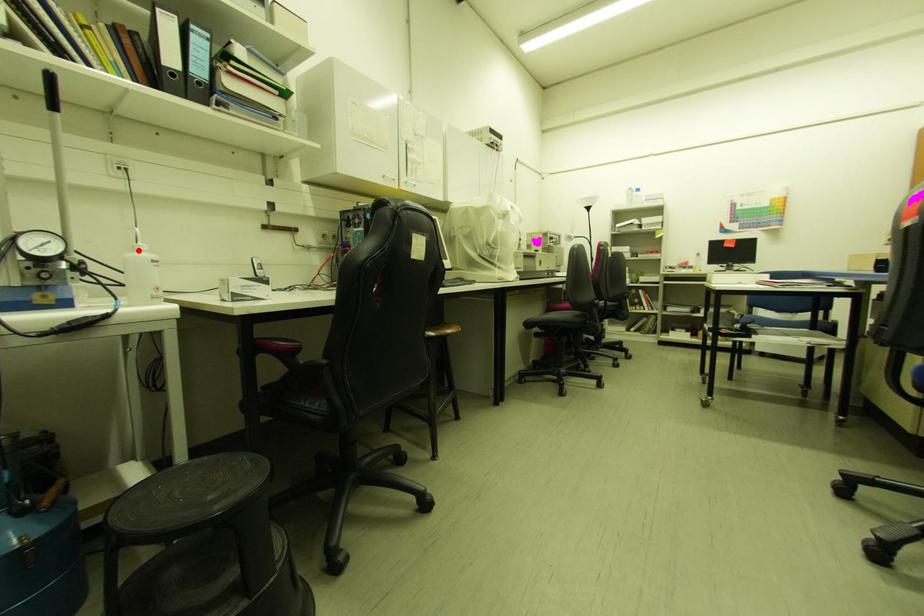
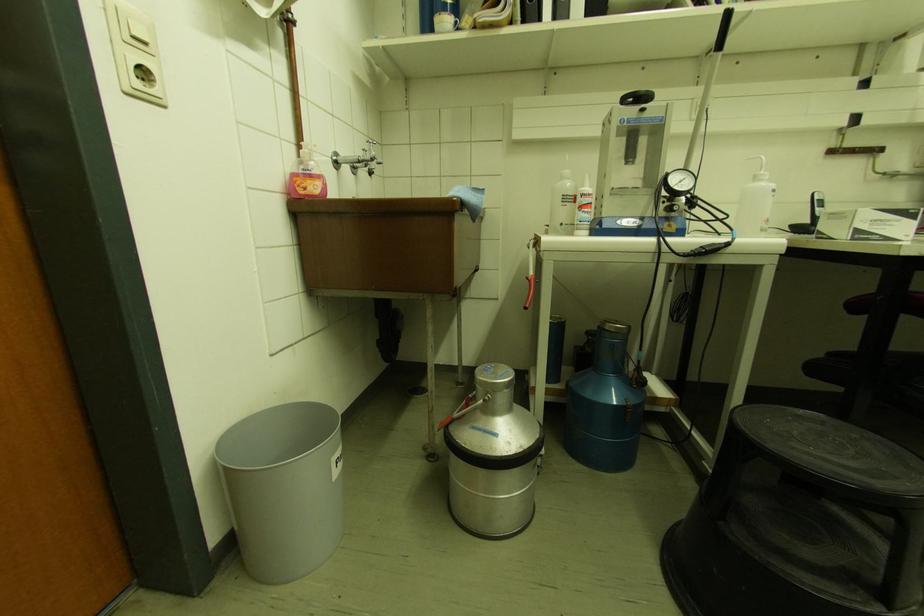
Where in the second image is the point corresponding to the highlighted location from the first image?

(759, 180)